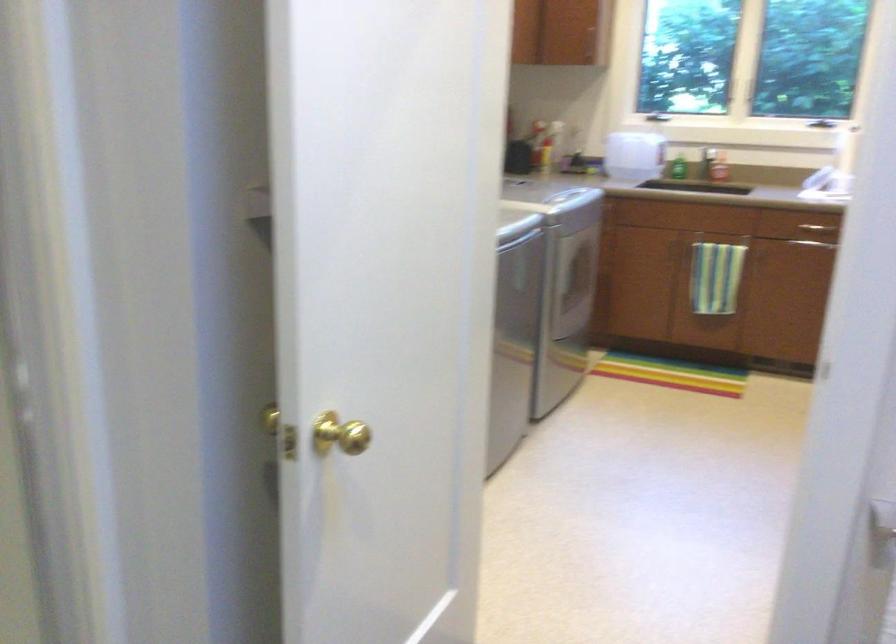
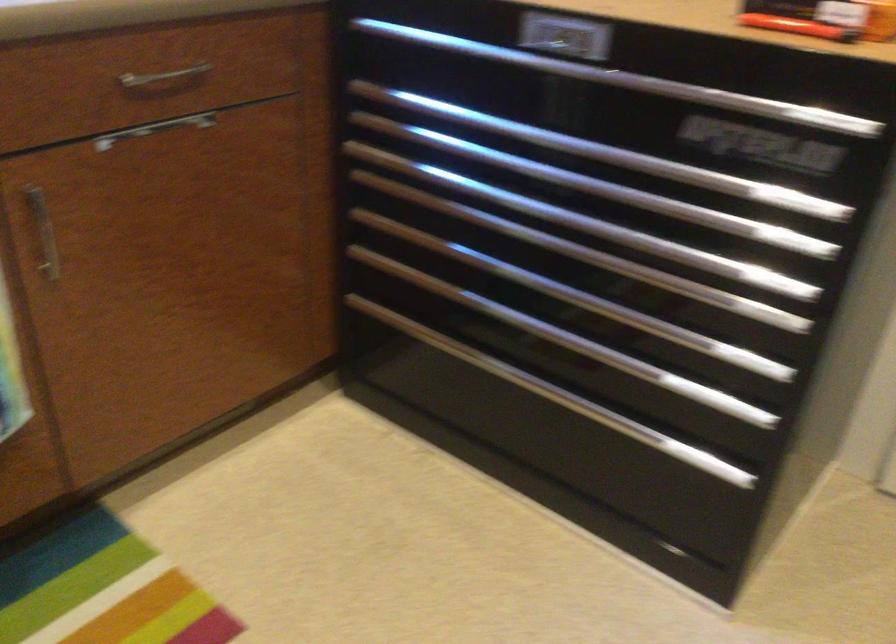
In the second image, find the point that corresponds to point 763,258 in the first image.

(42, 232)